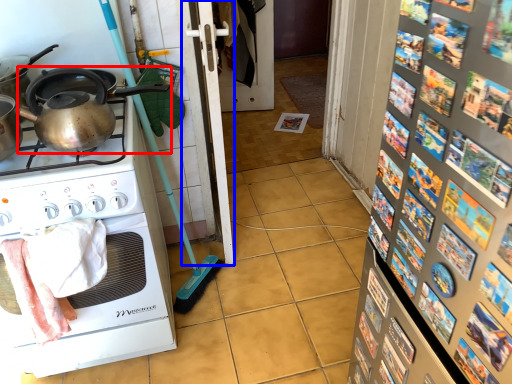
Question: Which object is closer to the camera taking this photo, kettle (highlighted by a red box) or screen door (highlighted by a blue box)?

Choices:
 (A) kettle
 (B) screen door

Answer: (A)